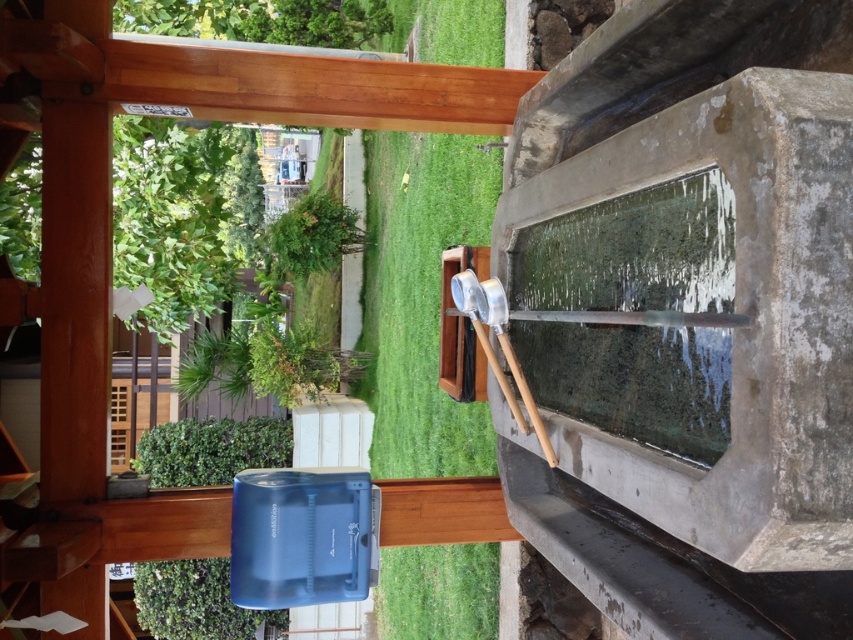
Question: Does blue plastic plant at lower left appear on the right side of green leafy plant at upper center?

Choices:
 (A) yes
 (B) no

Answer: (B)

Question: Which object appears farthest from the camera in this image?

Choices:
 (A) blue plastic plant at lower left
 (B) green grass at center
 (C) green leafy plant at upper center

Answer: (C)

Question: Is green grass at center closer to camera compared to green leafy plant at upper center?

Choices:
 (A) no
 (B) yes

Answer: (B)

Question: Can you confirm if green grass at center is smaller than blue plastic plant at lower left?

Choices:
 (A) no
 (B) yes

Answer: (B)

Question: Which object is farther from the camera taking this photo?

Choices:
 (A) green leafy plant at upper center
 (B) blue plastic plant at lower left

Answer: (A)

Question: Which object appears closest to the camera in this image?

Choices:
 (A) green grass at center
 (B) blue plastic plant at lower left

Answer: (A)